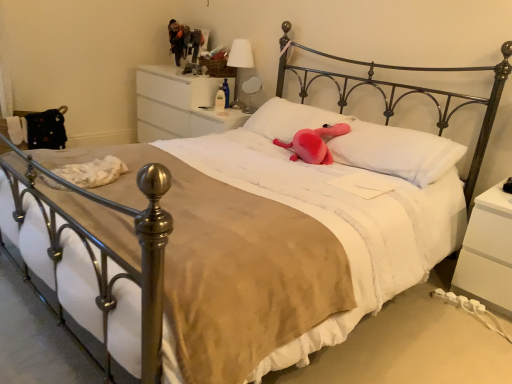
Question: Considering the relative positions of white matte nightstand at lower right, the 3th nightstand when ordered from top to bottom, and pink plush at center, positioned as the second pillow in left-to-right order, in the image provided, is white matte nightstand at lower right, the 3th nightstand when ordered from top to bottom, in front of pink plush at center, positioned as the second pillow in left-to-right order,?

Choices:
 (A) no
 (B) yes

Answer: (B)

Question: Does white matte nightstand at lower right, the 3th nightstand when ordered from top to bottom, appear on the right side of pink plush at center, the 1th pillow from the right?

Choices:
 (A) yes
 (B) no

Answer: (A)

Question: Can you confirm if white matte nightstand at lower right, which ranks as the 1th nightstand in bottom-to-top order, is smaller than pink plush at center, positioned as the second pillow in left-to-right order?

Choices:
 (A) yes
 (B) no

Answer: (B)

Question: Considering the relative sizes of white matte nightstand at lower right, the 3th nightstand when ordered from top to bottom, and pink plush at center, the 1th pillow from the right, in the image provided, is white matte nightstand at lower right, the 3th nightstand when ordered from top to bottom, bigger than pink plush at center, the 1th pillow from the right,?

Choices:
 (A) yes
 (B) no

Answer: (A)

Question: Is white matte nightstand at lower right, the third nightstand from the left, facing towards pink plush at center, positioned as the second pillow in left-to-right order?

Choices:
 (A) yes
 (B) no

Answer: (B)

Question: Does white matte nightstand at lower right, which ranks as the 1th nightstand in bottom-to-top order, come behind pink plush at center, positioned as the second pillow in left-to-right order?

Choices:
 (A) yes
 (B) no

Answer: (B)

Question: Is white glossy nightstand at upper center, the 2th nightstand positioned from the right, closer to the viewer compared to white matte nightstand at lower right, which ranks as the 1th nightstand in bottom-to-top order?

Choices:
 (A) no
 (B) yes

Answer: (A)

Question: From a real-world perspective, is white glossy nightstand at upper center, acting as the 2th nightstand starting from the front, on top of white matte nightstand at lower right, the 1th nightstand viewed from the front?

Choices:
 (A) no
 (B) yes

Answer: (B)

Question: From the image's perspective, does white glossy nightstand at upper center, acting as the 2th nightstand starting from the front, appear higher than white matte nightstand at lower right, the 1th nightstand viewed from the front?

Choices:
 (A) yes
 (B) no

Answer: (A)

Question: Would you say white glossy nightstand at upper center, acting as the 2th nightstand starting from the left, contains white matte nightstand at lower right, marked as the 3th nightstand in a back-to-front arrangement?

Choices:
 (A) no
 (B) yes

Answer: (A)

Question: Is white glossy nightstand at upper center, the 2th nightstand positioned from the right, facing away from white matte nightstand at lower right, the third nightstand from the left?

Choices:
 (A) no
 (B) yes

Answer: (A)

Question: Does white glossy nightstand at upper center, the second nightstand from the top, have a smaller size compared to white matte nightstand at lower right, which ranks as the 1th nightstand in bottom-to-top order?

Choices:
 (A) no
 (B) yes

Answer: (B)

Question: Is pink plush toy at center positioned behind white glossy nightstand at upper center, which ranks as the second nightstand in back-to-front order?

Choices:
 (A) yes
 (B) no

Answer: (B)